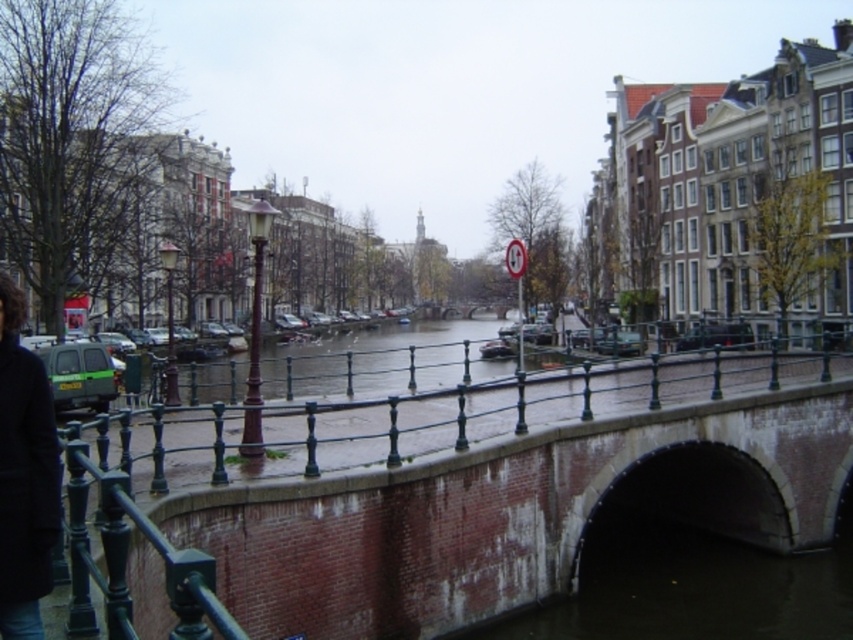
You are standing at the point marked by the coordinates point (x=523, y=500) in the image. What structure are you directly under?

You are directly under the brick bridge at center, as the coordinates point (x=523, y=500) corresponds to that structure.

You are a tourist standing on the street next to the canal. You see the brick bridge at center and the black wool coat at lower left. Which object is closer to your left side?

The black wool coat at lower left is closer to your left side because the brick bridge at center is positioned to its right side.